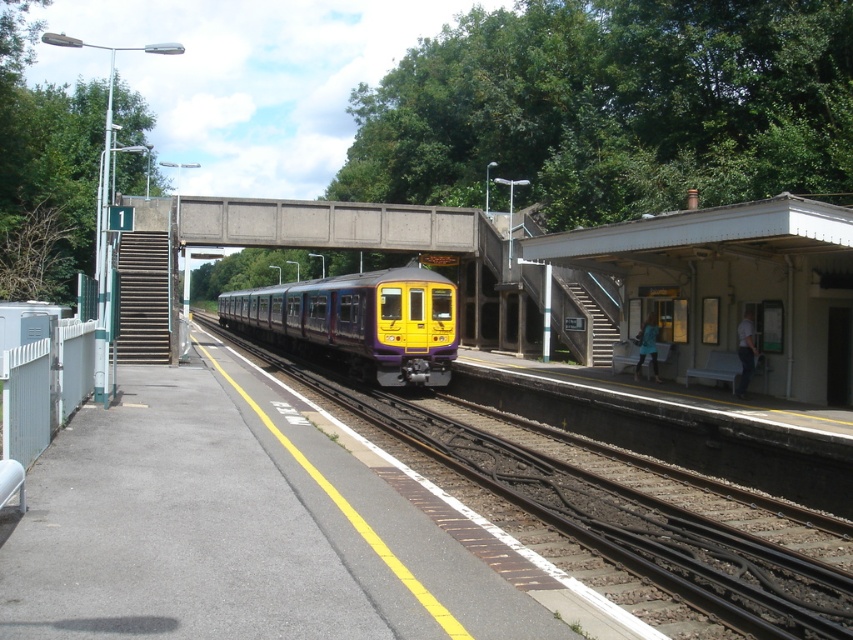
In the scene shown: You are a passenger waiting at the station. You notice the yellow matte train at center and the concrete at center. Which object is located above the other?

The yellow matte train at center is positioned under concrete at center, so the concrete at center is above the yellow matte train at center.

You are a maintenance worker needing to place a 3 meter wide equipment on the concrete at center. Can the yellow matte train at center allow enough space for this equipment to be placed there?

The yellow matte train at center might be wider than concrete at center, so there might not be enough space to place the 3 meter wide equipment there.

From the picture: You are standing on the platform at the railway station and want to walk to the point that is closer to the train. Which point should you go to, point (556, 472) or point (271, 321)?

Point (556, 472) is closer to the viewer than point (271, 321), so you should go to point (556, 472).